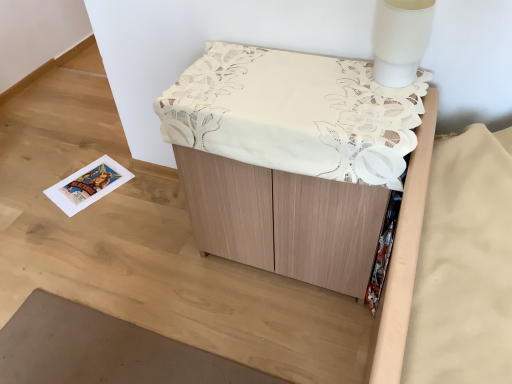
Find the location of a particular element. This screenshot has height=384, width=512. vacant region to the left of wooden cabinet at center is located at coordinates (151, 274).